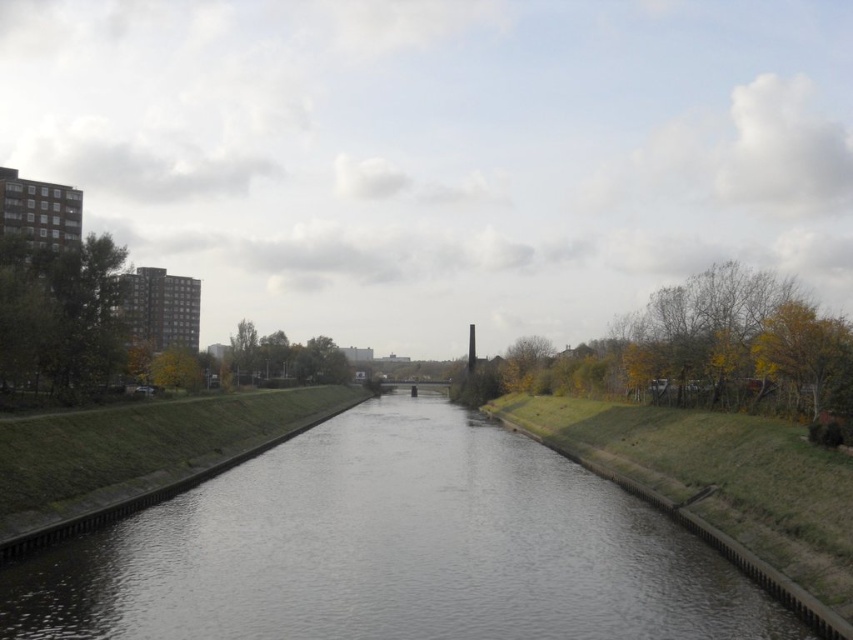
Question: Considering the relative positions of gray concrete river at center and green leafy tree at left in the image provided, where is gray concrete river at center located with respect to green leafy tree at left?

Choices:
 (A) above
 (B) below

Answer: (B)

Question: Is gray concrete river at center wider than green leafy tree at left?

Choices:
 (A) no
 (B) yes

Answer: (B)

Question: Does gray concrete river at center appear on the right side of green leafy tree at left?

Choices:
 (A) no
 (B) yes

Answer: (B)

Question: Which object appears farthest from the camera in this image?

Choices:
 (A) green leafy tree at left
 (B) gray concrete river at center

Answer: (A)